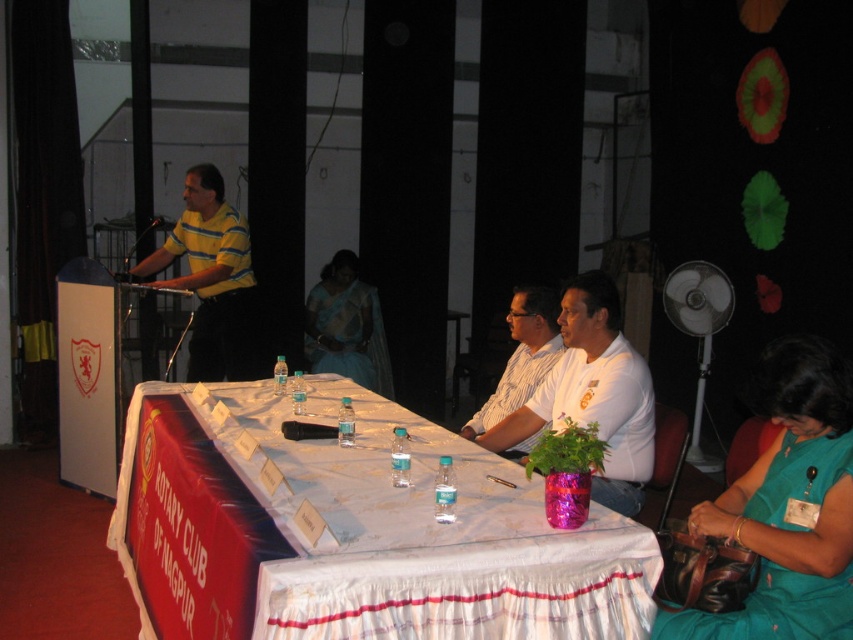
You are a photographer at the event and need to ensure that all attendees are visible in the group photo. Considering the teal fabric dress at lower right and the yellow striped shirt at left, which one might be partially obscured if someone is standing behind them?

The teal fabric dress at lower right has a lesser height compared to the yellow striped shirt at left, so the teal fabric dress at lower right might be partially obscured if someone is standing behind them.

You are organizing a photo shoot for a fashion magazine and need to decide which outfit takes up more space when seated. Based on the scene description, which outfit between the teal fabric dress at lower right and the silk sari at center would require more space?

The silk sari at center requires more space when seated because its width is greater than the teal fabric dress at lower right.